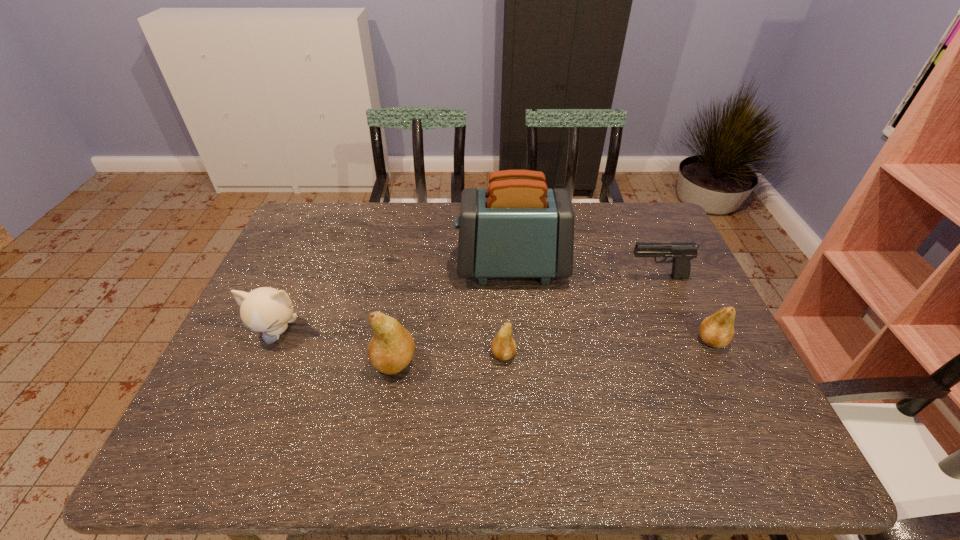
Locate an element on the screen. This screenshot has height=540, width=960. free space located on the face of the kitten is located at coordinates (251, 391).

You are a GUI agent. You are given a task and a screenshot of the screen. Output one action in this format:
    pyautogui.click(x=<x>, y=<y>)
    Task: Click on the vacant space located 0.280m on the front-facing side of the toaster
    Image resolution: width=960 pixels, height=540 pixels.
    Given the screenshot: What is the action you would take?
    pyautogui.click(x=364, y=267)

The image size is (960, 540). In order to click on vacant space situated 0.070m on the front-facing side of the toaster in this screenshot , I will do `click(434, 267)`.

Find the location of a particular element. vacant area situated on the front-facing side of the toaster is located at coordinates (377, 267).

The height and width of the screenshot is (540, 960). I want to click on free space located aim along the barrel of the pistol, so click(569, 278).

Identify the location of free space located 0.090m aim along the barrel of the pistol. (596, 278).

The width and height of the screenshot is (960, 540). Find the location of `vacant region located 0.380m aim along the barrel of the pistol`. vacant region located 0.380m aim along the barrel of the pistol is located at coordinates (497, 278).

Where is `object positioned at the left edge`? The width and height of the screenshot is (960, 540). object positioned at the left edge is located at coordinates (268, 310).

What are the coordinates of `pear located at the right edge` in the screenshot? It's located at (717, 330).

Where is `pistol present at the right edge`? pistol present at the right edge is located at coordinates (682, 252).